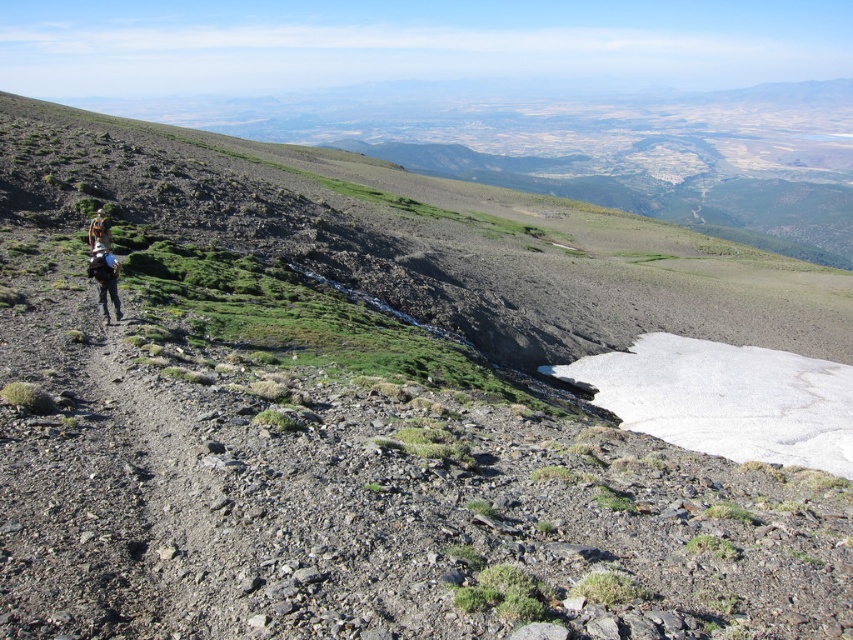
Can you confirm if dull gray gravel at center is bigger than camouflage jacket at left?

No.

Between point (190, 630) and point (109, 237), which one is positioned behind?

Point (109, 237)

I want to click on dull gray gravel at center, so 181,490.

Is matte black backpack at lower left closer to camera compared to camouflage jacket at left?

Yes, it is.

Does matte black backpack at lower left have a smaller size compared to camouflage jacket at left?

Indeed, matte black backpack at lower left has a smaller size compared to camouflage jacket at left.

Does point (96, 257) come in front of point (100, 230)?

Yes.

The height and width of the screenshot is (640, 853). I want to click on matte black backpack at lower left, so click(x=105, y=278).

Identify the location of dull gray gravel at center. This screenshot has height=640, width=853. pyautogui.click(x=181, y=490).

Which is in front, point (161, 419) or point (100, 291)?

Point (161, 419) is more forward.

Locate an element on the screen. dull gray gravel at center is located at coordinates (181, 490).